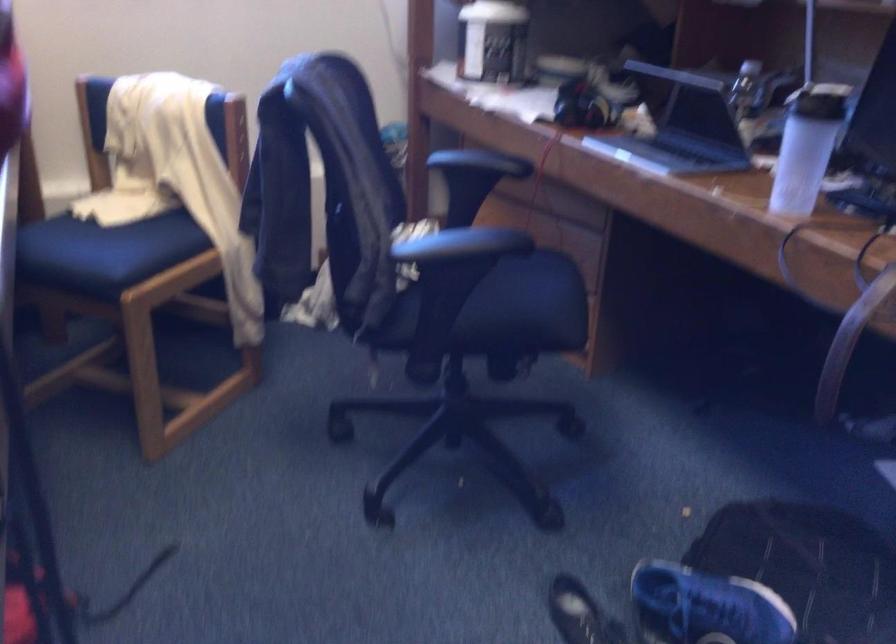
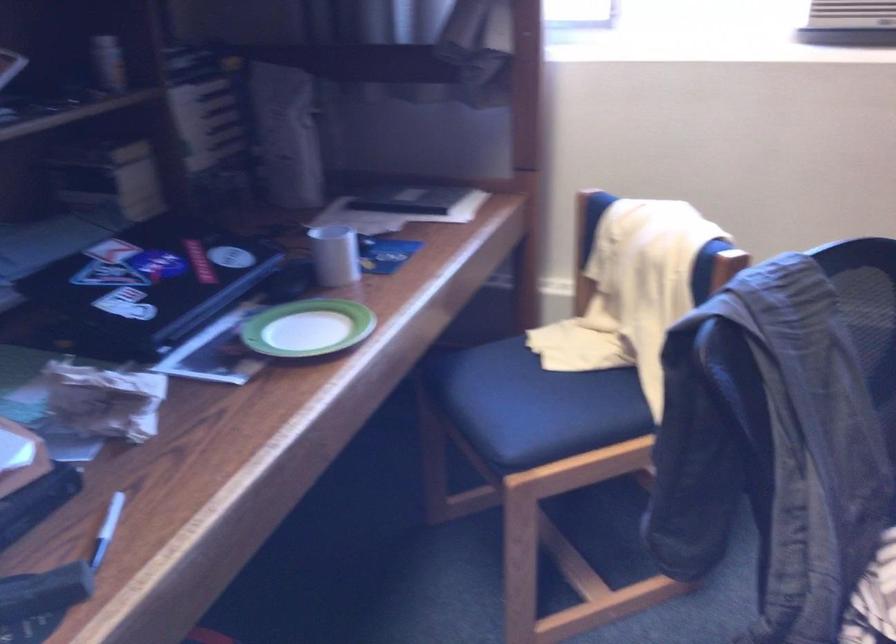
Find the pixel in the second image that matches point 144,236 in the first image.

(576, 393)